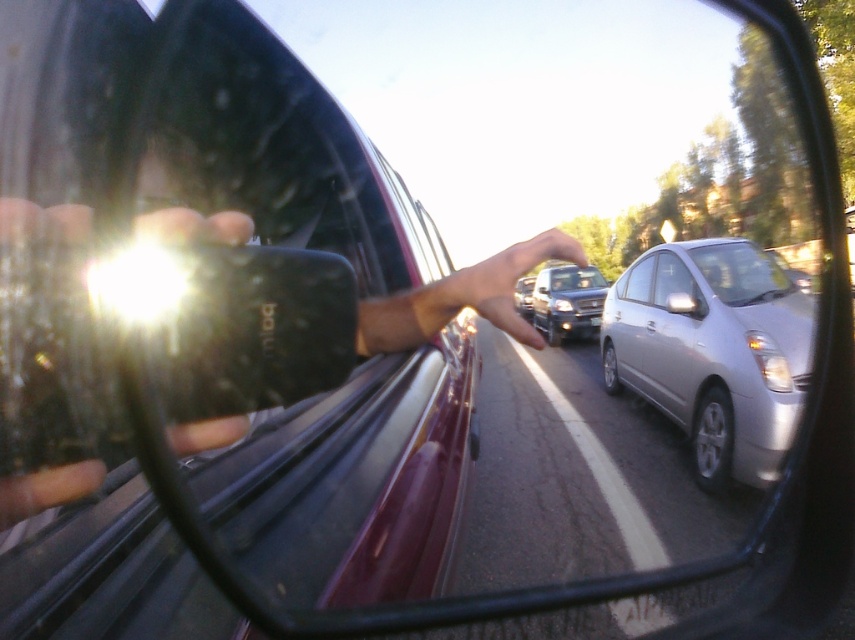
You are a driver trying to park your car. You look at the car through the side mirror and see the silver metallic car at center. Based on its position in the mirror, can you estimate whether it is closer to the front or the back of your car?

The silver metallic car at center is positioned at coordinates point (712, 352), which places it closer to the back of your car since the coordinates suggest it is further away from the front section of the vehicle.

You are driving a car and notice two metallic silver vehicles in your side mirror. According to the scene, which one is closer to you, the silver metallic car at center or the metallic silver sedan at center?

The silver metallic car at center is closer to you because it is positioned in front of the metallic silver sedan at center in the mirror.